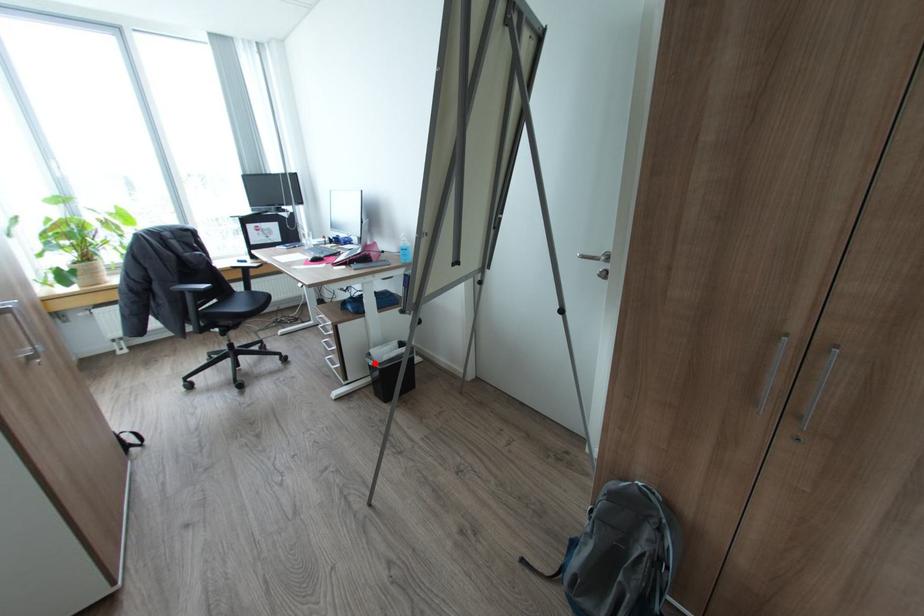
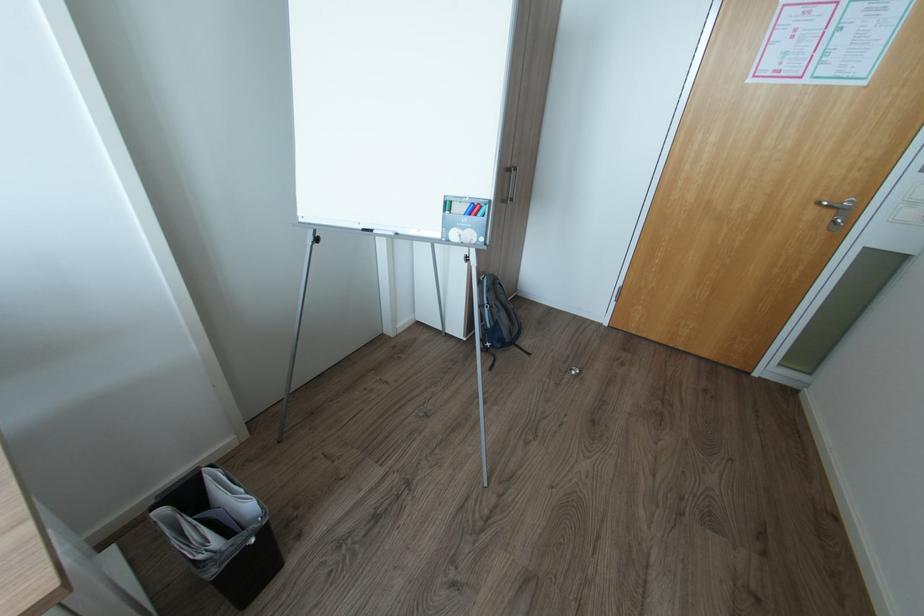
Question: I am providing you with two images of the same scene from different viewpoints. Image1 has a red point marked. In image2, the corresponding 3D location appears at what relative position? Reply with the corresponding letter.

Choices:
 (A) Closer
 (B) Farther

Answer: (A)